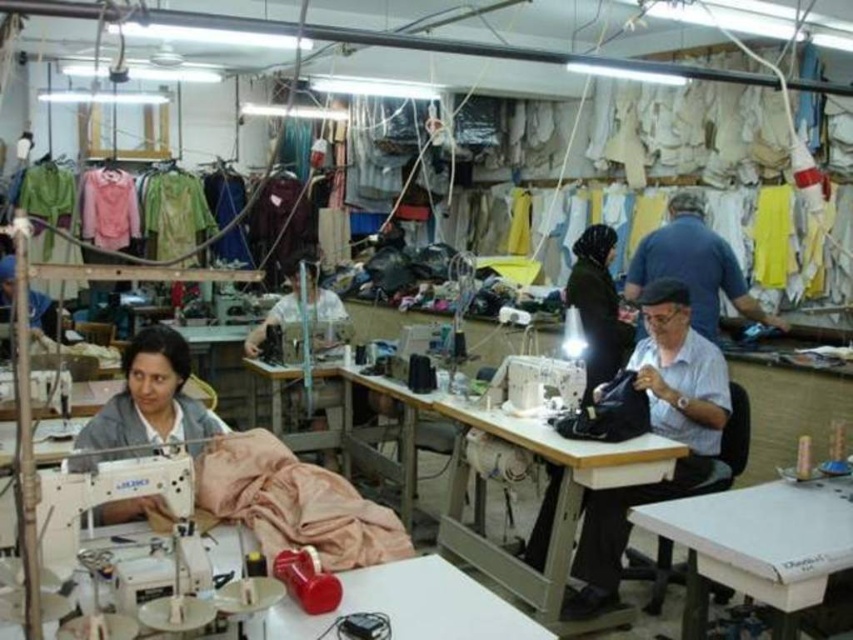
Question: Which object is positioned closest to the blue cotton shirt at upper right?

Choices:
 (A) matte gray sweater at left
 (B) white plastic sewing machine at lower left

Answer: (A)

Question: Considering the real-world distances, which object is closest to the blue cotton shirt at upper right?

Choices:
 (A) matte gray sweater at left
 (B) white plastic sewing machine at lower left

Answer: (A)

Question: In this image, where is white plastic sewing machine at lower left located relative to dark green fabric at center?

Choices:
 (A) below
 (B) above

Answer: (A)

Question: Which object is farther from the camera taking this photo?

Choices:
 (A) white plastic sewing machine at lower left
 (B) light blue fabric at center

Answer: (B)

Question: Can you confirm if blue cotton shirt at upper right is smaller than dark green fabric at center?

Choices:
 (A) no
 (B) yes

Answer: (A)

Question: Does white plastic sewing machine at lower left have a lesser width compared to blue cotton shirt at upper right?

Choices:
 (A) no
 (B) yes

Answer: (B)